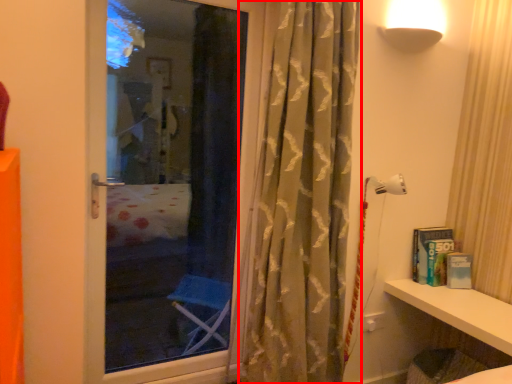
Question: From the image, what is the correct spatial relationship of curtain (annotated by the red box) in relation to shelf?

Choices:
 (A) right
 (B) left

Answer: (B)